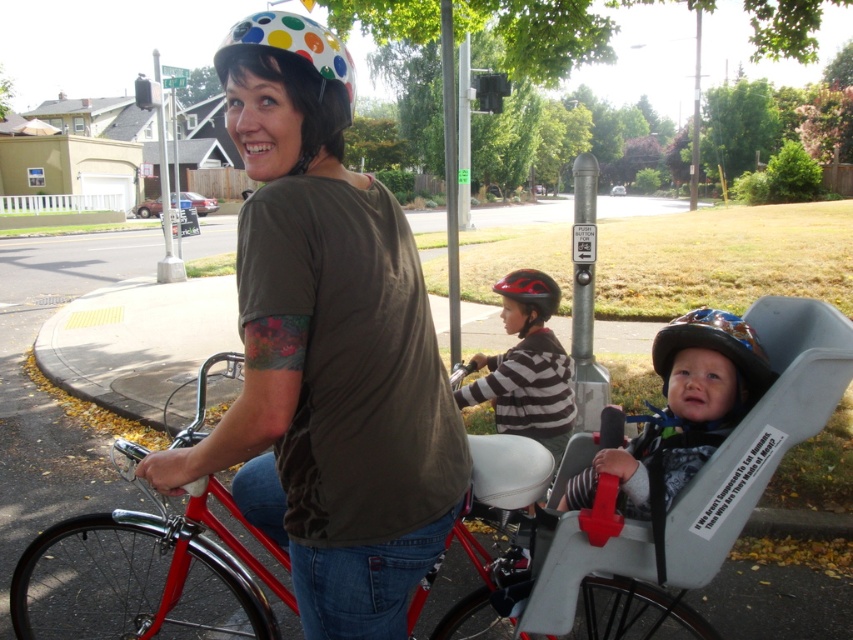
Is shiny blue helmet at center thinner than brushed metal pole at center?

Correct, shiny blue helmet at center's width is less than brushed metal pole at center's.

Is shiny blue helmet at center smaller than brushed metal pole at center?

Yes, shiny blue helmet at center is smaller than brushed metal pole at center.

Which is behind, point (692, 337) or point (442, 54)?

Positioned behind is point (442, 54).

This screenshot has height=640, width=853. Find the location of `shiny blue helmet at center`. shiny blue helmet at center is located at coordinates (715, 348).

Is striped cotton shirt at center bigger than white polka dot helmet at upper center?

No.

What are the coordinates of `striped cotton shirt at center` in the screenshot? It's located at (527, 365).

The image size is (853, 640). What do you see at coordinates (527, 365) in the screenshot? I see `striped cotton shirt at center` at bounding box center [527, 365].

Where is `striped cotton shirt at center`? Image resolution: width=853 pixels, height=640 pixels. striped cotton shirt at center is located at coordinates (527, 365).

Is point (51, 547) less distant than point (491, 355)?

That is True.

Find the location of a particular element. The image size is (853, 640). shiny red bicycle at center is located at coordinates (146, 576).

Find the location of a particular element. Image resolution: width=853 pixels, height=640 pixels. shiny red bicycle at center is located at coordinates (146, 576).